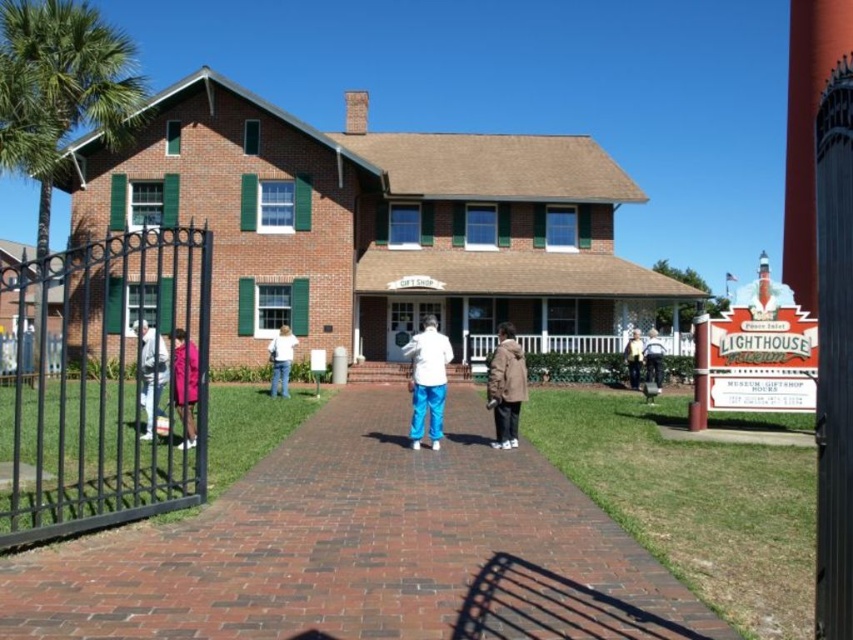
Question: Does matte pink coat at center appear on the left side of white glossy door at center?

Choices:
 (A) no
 (B) yes

Answer: (B)

Question: Does white fabric pants at left lie in front of white glossy door at center?

Choices:
 (A) no
 (B) yes

Answer: (B)

Question: Among these points, which one is farthest from the camera?

Choices:
 (A) (106, 324)
 (B) (804, 257)
 (C) (155, 410)

Answer: (B)

Question: Is smooth red tower at upper right wider than brown leather jacket at center?

Choices:
 (A) no
 (B) yes

Answer: (B)

Question: Which point appears closest to the camera in this image?

Choices:
 (A) (32, 300)
 (B) (270, 352)
 (C) (146, 611)
 (D) (158, 369)

Answer: (C)

Question: Which object appears closest to the camera in this image?

Choices:
 (A) black wrought iron gate at left
 (B) brown leather jacket at center

Answer: (A)